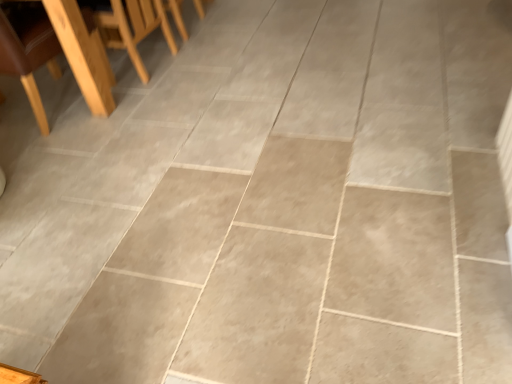
Locate an element on the screen. The height and width of the screenshot is (384, 512). vacant space in front of wooden chair at upper left is located at coordinates (72, 150).